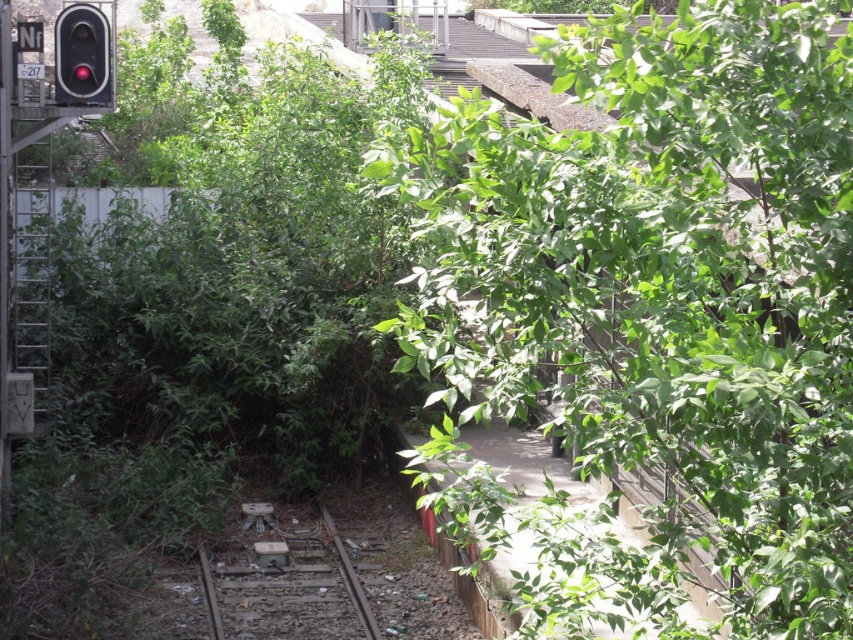
How distant is green leafy tree at upper right from dull metallic train track at center?

green leafy tree at upper right and dull metallic train track at center are 5.05 meters apart from each other.

Consider the image. Is green leafy tree at upper right to the left of dull metallic train track at center from the viewer's perspective?

No, green leafy tree at upper right is not to the left of dull metallic train track at center.

This screenshot has width=853, height=640. Describe the element at coordinates (653, 314) in the screenshot. I see `green leafy tree at upper right` at that location.

Locate an element on the screen. green leafy tree at upper right is located at coordinates (653, 314).

What do you see at coordinates (283, 582) in the screenshot?
I see `dull metallic train track at center` at bounding box center [283, 582].

Is the position of dull metallic train track at center more distant than that of metallic red traffic light at upper left?

No.

Does point (276, 563) come behind point (70, 72)?

Yes, point (276, 563) is behind point (70, 72).

You are a GUI agent. You are given a task and a screenshot of the screen. Output one action in this format:
    pyautogui.click(x=<x>, y=<y>)
    Task: Click on the dull metallic train track at center
    Image resolution: width=853 pixels, height=640 pixels.
    Given the screenshot: What is the action you would take?
    pyautogui.click(x=283, y=582)

Can you confirm if green leafy tree at upper right is thinner than metallic red traffic light at upper left?

No.

Does point (666, 545) come closer to viewer compared to point (67, 99)?

Yes, it is in front of point (67, 99).

Locate an element on the screen. green leafy tree at upper right is located at coordinates (653, 314).